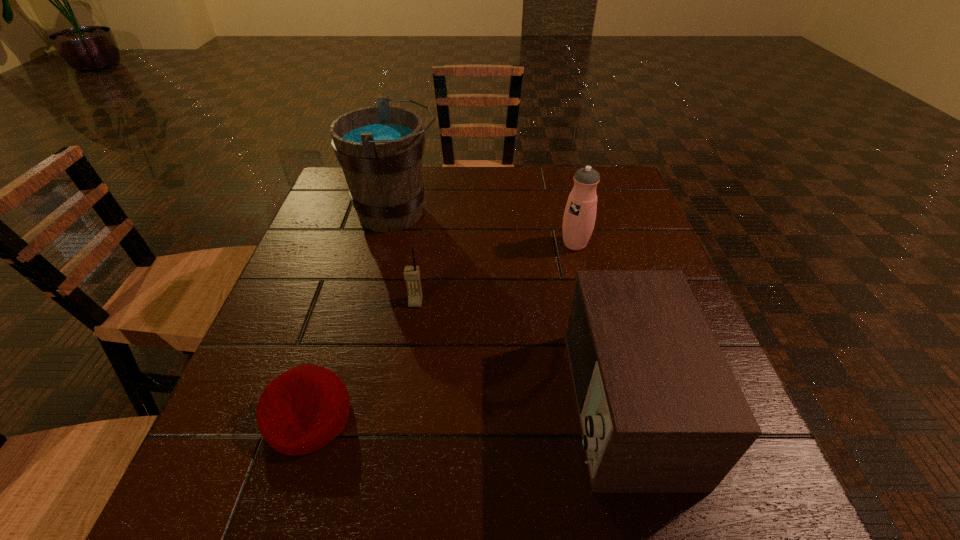
Locate an element on the screen. This screenshot has width=960, height=540. vacant space that is in between the radio receiver and the third farthest object is located at coordinates click(x=519, y=353).

At what (x,y) coordinates should I click in order to perform the action: click on free space that is in between the third nearest object and the radio receiver. Please return your answer as a coordinate pair (x, y). Looking at the image, I should click on (519, 353).

The width and height of the screenshot is (960, 540). What are the coordinates of `empty space that is in between the wine bucket and the shortest object` in the screenshot? It's located at (352, 314).

Identify the location of free spot between the second shortest object and the wine bucket. The width and height of the screenshot is (960, 540). (406, 258).

Where is `free space between the fourth tallest object and the tallest object`? free space between the fourth tallest object and the tallest object is located at coordinates (406, 258).

This screenshot has height=540, width=960. Identify the location of the third closest object to the radio receiver. (302, 410).

Where is `the third closest object to the thermos bottle`? The height and width of the screenshot is (540, 960). the third closest object to the thermos bottle is located at coordinates (411, 273).

You are a GUI agent. You are given a task and a screenshot of the screen. Output one action in this format:
    pyautogui.click(x=<x>, y=<y>)
    Task: Click on the vacant area in the image that satisfies the following two spatial constraints: 1. with a handle on the side of the tallest object; 2. on the seat area of the shortest object
    The image size is (960, 540).
    Given the screenshot: What is the action you would take?
    pyautogui.click(x=348, y=416)